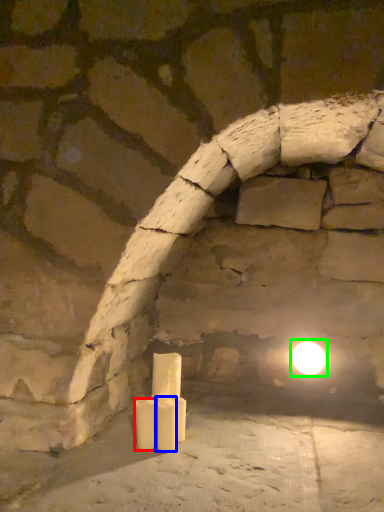
Question: Considering the real-world distances, which object is farthest from candle (highlighted by a red box)? candle (highlighted by a blue box) or moonlight (highlighted by a green box)?

Choices:
 (A) candle
 (B) moonlight

Answer: (B)